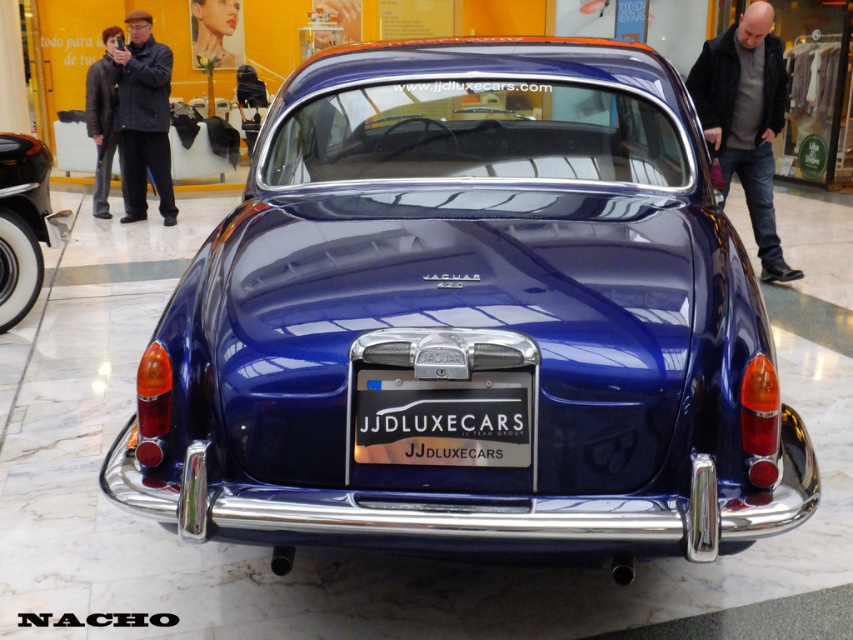
Question: Can you confirm if shiny blue car at right is positioned to the right of white wall at left?

Choices:
 (A) yes
 (B) no

Answer: (A)

Question: Can you confirm if glossy blue car at center is wider than black metallic license plate at center?

Choices:
 (A) yes
 (B) no

Answer: (A)

Question: Estimate the real-world distances between objects in this image. Which object is closer to the shiny blue car at right?

Choices:
 (A) glossy blue car at center
 (B) white wall at left
 (C) black metallic license plate at center

Answer: (A)

Question: Is black metallic license plate at center below white wall at left?

Choices:
 (A) yes
 (B) no

Answer: (A)

Question: Estimate the real-world distances between objects in this image. Which object is closer to the glossy blue car at center?

Choices:
 (A) black metallic license plate at center
 (B) white wall at left
 (C) shiny blue car at right

Answer: (A)

Question: Considering the real-world distances, which object is closest to the shiny blue car at right?

Choices:
 (A) glossy blue car at center
 (B) white wall at left
 (C) black metallic license plate at center

Answer: (A)